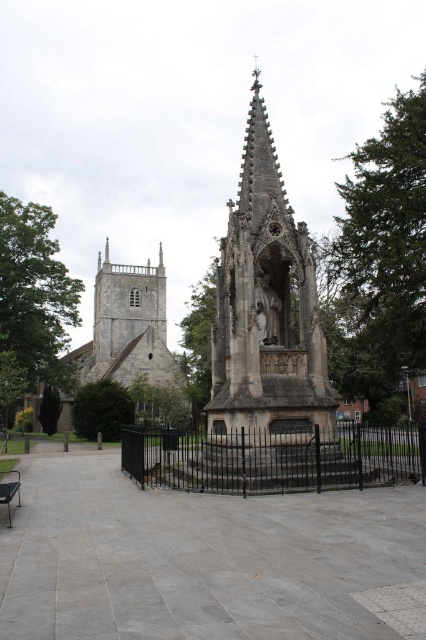
Question: Which point appears farthest from the camera in this image?

Choices:
 (A) (420, 442)
 (B) (226, 305)
 (C) (86, 369)
 (D) (267, 320)

Answer: (C)

Question: Does stone gothic monument at center have a lesser width compared to stone church at center?

Choices:
 (A) no
 (B) yes

Answer: (B)

Question: Is stone gothic monument at center positioned behind black metal fence at center?

Choices:
 (A) no
 (B) yes

Answer: (B)

Question: Is black metal fence at center to the right of stone church at center from the viewer's perspective?

Choices:
 (A) no
 (B) yes

Answer: (B)

Question: Which object is positioned farthest from the stone church at center?

Choices:
 (A) stone gothic monument at center
 (B) black metal fence at center
 (C) polished stone statue at center
 (D) black metal bench at lower left

Answer: (D)

Question: Among these objects, which one is farthest from the camera?

Choices:
 (A) stone gothic monument at center
 (B) black metal bench at lower left
 (C) black metal fence at center
 (D) polished stone statue at center

Answer: (D)